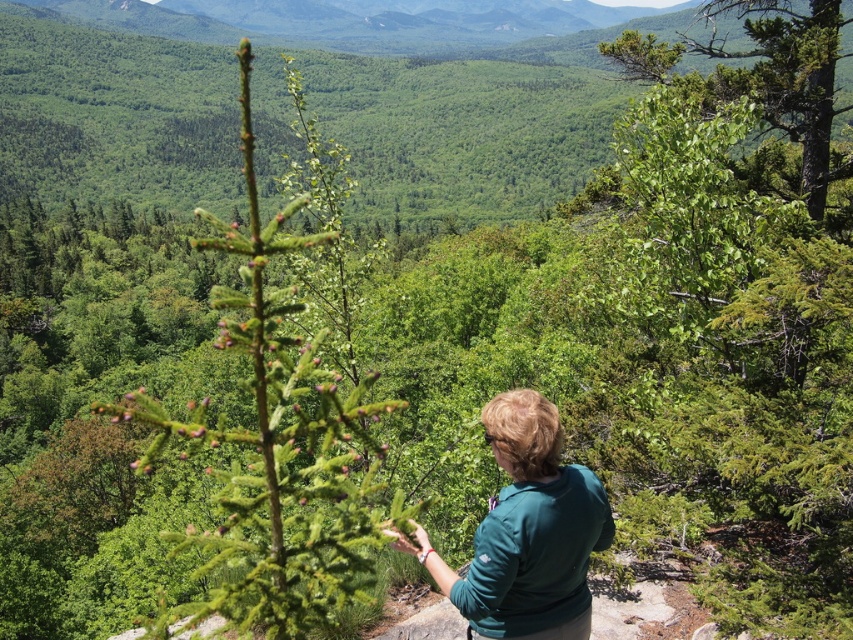
You are a photographer positioned at the center of the scene. You want to capture a photo that includes both the green matte shirt at center and the green leafy tree at upper right. Which object should you adjust your camera angle towards to include both in the frame?

To include both the green matte shirt at center and the green leafy tree at upper right in the frame, you should adjust your camera angle towards the green leafy tree at upper right since the green matte shirt at center is to the left of it.

You are standing at the viewpoint overlooking the valley and see two points marked in the image. Which point is closer to you, point (282,573) or point (527,588)?

Point (282,573) is in front of point (527,588), so it is closer to you.